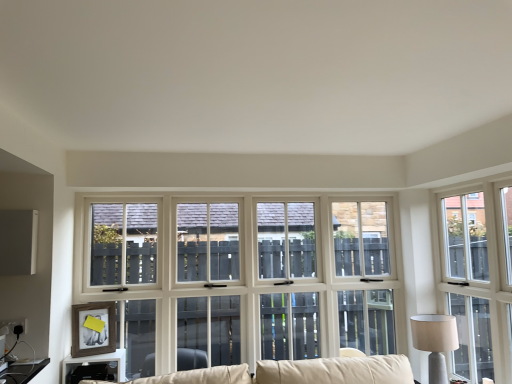
Question: Does matte black table at lower left have a lesser width compared to white wood window at right?

Choices:
 (A) no
 (B) yes

Answer: (A)

Question: Does matte black table at lower left have a lesser height compared to white wood window at right?

Choices:
 (A) no
 (B) yes

Answer: (B)

Question: Are matte black table at lower left and white wood window at right located far from each other?

Choices:
 (A) yes
 (B) no

Answer: (A)

Question: Is white wood window at right surrounded by matte black table at lower left?

Choices:
 (A) yes
 (B) no

Answer: (B)

Question: Considering the relative positions of matte black table at lower left and white wood window at right in the image provided, is matte black table at lower left to the left of white wood window at right from the viewer's perspective?

Choices:
 (A) no
 (B) yes

Answer: (B)

Question: Is point (117, 349) closer or farther from the camera than point (479, 223)?

Choices:
 (A) farther
 (B) closer

Answer: (B)

Question: From the image's perspective, relative to white wood window at right, is matte black table at lower left above or below?

Choices:
 (A) below
 (B) above

Answer: (A)

Question: Based on their positions, is matte black table at lower left located to the left or right of white wood window at right?

Choices:
 (A) right
 (B) left

Answer: (B)

Question: Is matte black table at lower left in front of or behind white wood window at right in the image?

Choices:
 (A) front
 (B) behind

Answer: (B)

Question: In the image, is white wood window at right positioned in front of or behind beige fabric lampshade at right?

Choices:
 (A) behind
 (B) front

Answer: (B)

Question: From the image's perspective, is white wood window at right above or below beige fabric lampshade at right?

Choices:
 (A) below
 (B) above

Answer: (B)

Question: From a real-world perspective, is white wood window at right above or below beige fabric lampshade at right?

Choices:
 (A) above
 (B) below

Answer: (A)

Question: Is white wood window at right to the left or to the right of beige fabric lampshade at right in the image?

Choices:
 (A) left
 (B) right

Answer: (B)

Question: Is point (440, 374) positioned closer to the camera than point (462, 220)?

Choices:
 (A) closer
 (B) farther

Answer: (A)

Question: Based on their positions, is beige fabric lampshade at right located to the left or right of white wood window at right?

Choices:
 (A) right
 (B) left

Answer: (B)